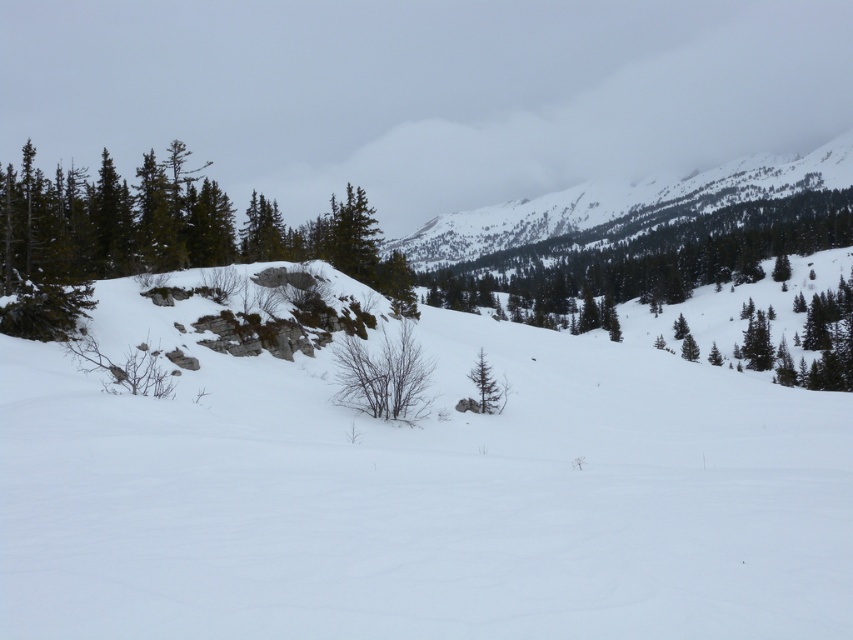
Does white powdery snow at center have a larger size compared to green textured tree at center?

Incorrect, white powdery snow at center is not larger than green textured tree at center.

Is point (683, 512) positioned in front of point (451, 305)?

Yes, it is in front of point (451, 305).

Who is more forward, [608,346] or [827,192]?

Point [608,346] is in front.

The height and width of the screenshot is (640, 853). In order to click on white powdery snow at center in this screenshot , I will do `click(418, 493)`.

From the picture: Which of these two, white powdery snow at center or green matte tree at center, stands taller?

Standing taller between the two is white powdery snow at center.

Is white powdery snow at center taller than green matte tree at center?

Yes, white powdery snow at center is taller than green matte tree at center.

Describe the element at coordinates (418, 493) in the screenshot. I see `white powdery snow at center` at that location.

The height and width of the screenshot is (640, 853). Find the location of `white powdery snow at center`. white powdery snow at center is located at coordinates (418, 493).

Between green textured tree at center and green matte tree at center, which one is positioned higher?

green textured tree at center is higher up.

Between point (579, 259) and point (486, 369), which one is positioned in front?

Positioned in front is point (486, 369).

Is point (621, 288) positioned before point (476, 365)?

No.

Find the location of a particular element. The image size is (853, 640). green textured tree at center is located at coordinates (650, 253).